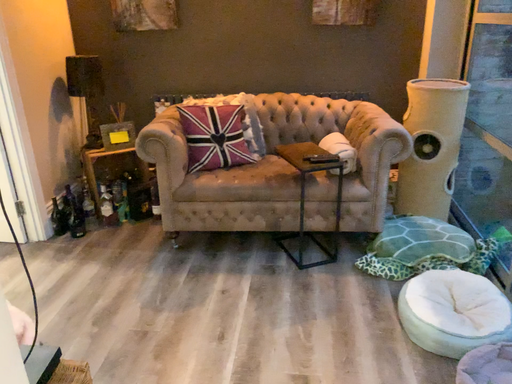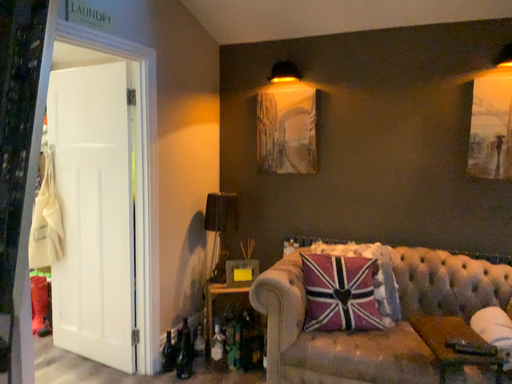
Question: Which way did the camera rotate in the video?

Choices:
 (A) rotated right
 (B) rotated left

Answer: (B)